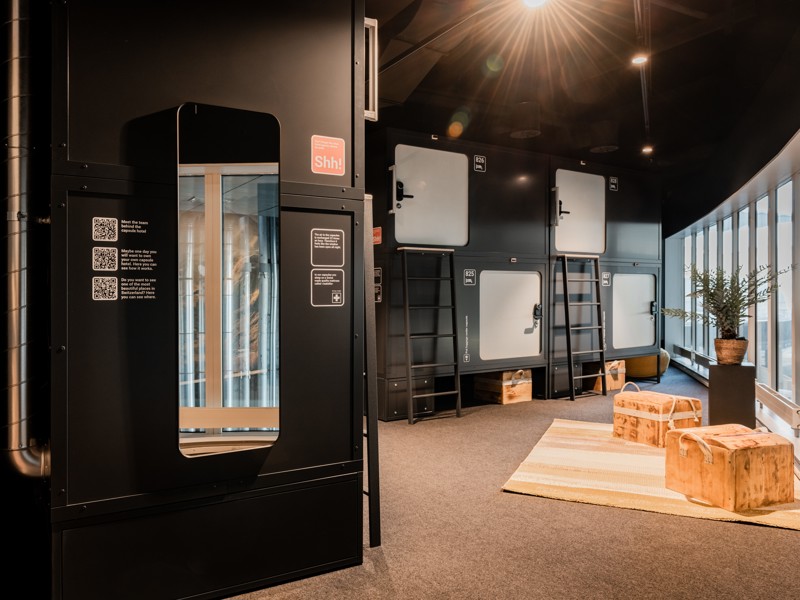
What are the coordinates of `radiator` in the screenshot? It's located at (785, 412), (680, 349), (698, 359).